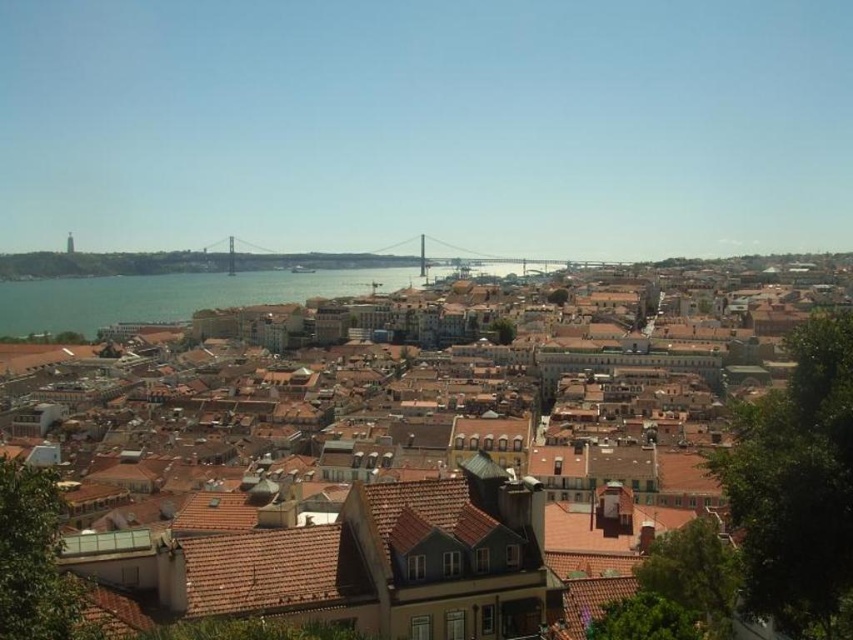
You are a tourist standing on the riverbank looking towards the city. You see the brown tiled roofs at center and the silver metallic bridge at center. Which object is located to the right side of the other?

The brown tiled roofs at center is positioned on the right side of the silver metallic bridge at center.

You are a tourist standing at the edge of the city looking towards the river. You see the brown tiled roofs at center and the silver metallic bridge at center. Which object is closer to you?

The brown tiled roofs at center are closer to you since they are positioned in front of the silver metallic bridge at center.

You are a city planner analyzing a cityscape image. You need to determine which object occupies more space in the image between the brown tiled roofs at center and the silver metallic bridge at center. Based on the scene, which one is larger?

The brown tiled roofs at center is larger in size than the silver metallic bridge at center, so the brown tiled roofs at center occupies more space in the image.